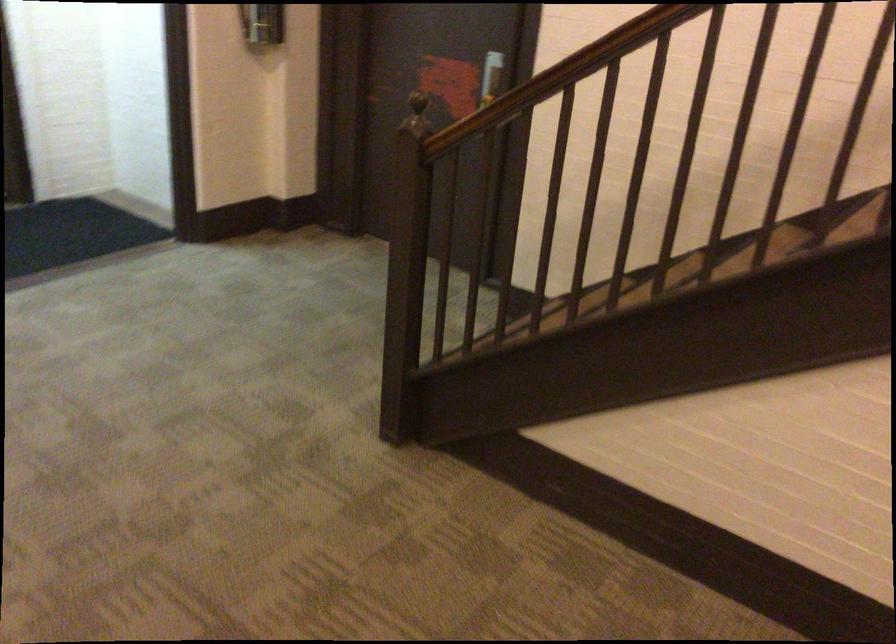
This screenshot has height=644, width=896. Find the location of `brown wood finial`. brown wood finial is located at coordinates (417, 115).